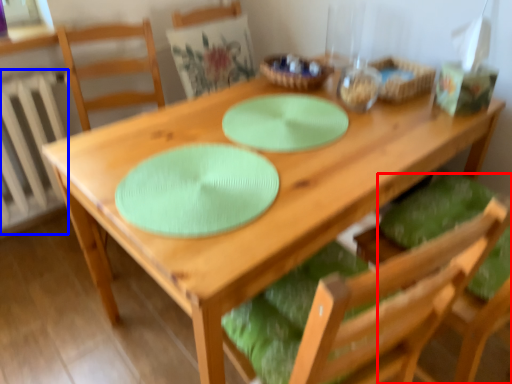
Question: Which of the following is the closest to the observer, chair (highlighted by a red box) or radiator (highlighted by a blue box)?

Choices:
 (A) chair
 (B) radiator

Answer: (A)